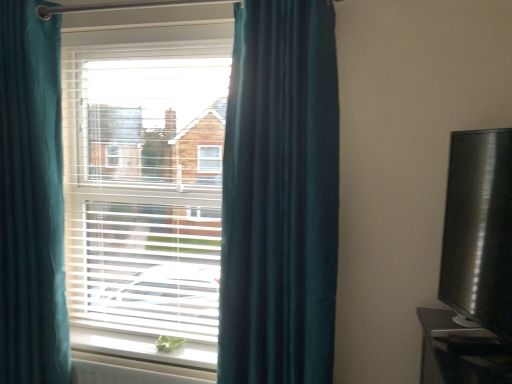
Question: Is white plastic blinds at center taller than white plastic radiator at lower center?

Choices:
 (A) no
 (B) yes

Answer: (B)

Question: From the image's perspective, is white plastic blinds at center below white plastic radiator at lower center?

Choices:
 (A) no
 (B) yes

Answer: (A)

Question: Does white plastic blinds at center come in front of white plastic radiator at lower center?

Choices:
 (A) yes
 (B) no

Answer: (B)

Question: Is white plastic blinds at center to the right of white plastic radiator at lower center from the viewer's perspective?

Choices:
 (A) yes
 (B) no

Answer: (B)

Question: Is white plastic blinds at center further to camera compared to white plastic radiator at lower center?

Choices:
 (A) no
 (B) yes

Answer: (B)

Question: Considering the positions of teal fabric curtain at left, the second curtain from the right, and teal velvet curtain at left, the first curtain positioned from the right, in the image, is teal fabric curtain at left, the second curtain from the right, wider or thinner than teal velvet curtain at left, the first curtain positioned from the right,?

Choices:
 (A) wide
 (B) thin

Answer: (B)

Question: Based on their sizes in the image, would you say teal fabric curtain at left, acting as the 1th curtain starting from the left, is bigger or smaller than teal velvet curtain at left, which is the 2th curtain in left-to-right order?

Choices:
 (A) big
 (B) small

Answer: (B)

Question: Based on their positions, is teal fabric curtain at left, the second curtain from the right, located to the left or right of teal velvet curtain at left, which is the 2th curtain in left-to-right order?

Choices:
 (A) right
 (B) left

Answer: (B)

Question: Is point (25, 188) closer or farther from the camera than point (320, 145)?

Choices:
 (A) closer
 (B) farther

Answer: (B)

Question: Does point (223, 316) appear closer or farther from the camera than point (19, 327)?

Choices:
 (A) closer
 (B) farther

Answer: (A)

Question: Is teal velvet curtain at left, which is the 2th curtain in left-to-right order, to the left or to the right of teal fabric curtain at left, acting as the 1th curtain starting from the left, in the image?

Choices:
 (A) right
 (B) left

Answer: (A)

Question: Looking at their shapes, would you say teal velvet curtain at left, the first curtain positioned from the right, is wider or thinner than teal fabric curtain at left, the second curtain from the right?

Choices:
 (A) wide
 (B) thin

Answer: (A)

Question: Choose the correct answer: Is teal velvet curtain at left, which is the 2th curtain in left-to-right order, inside teal fabric curtain at left, the second curtain from the right, or outside it?

Choices:
 (A) outside
 (B) inside

Answer: (A)

Question: Relative to white matte window sill at lower center, is white plastic radiator at lower center in front or behind?

Choices:
 (A) front
 (B) behind

Answer: (A)

Question: From a real-world perspective, relative to white matte window sill at lower center, is white plastic radiator at lower center vertically above or below?

Choices:
 (A) above
 (B) below

Answer: (B)